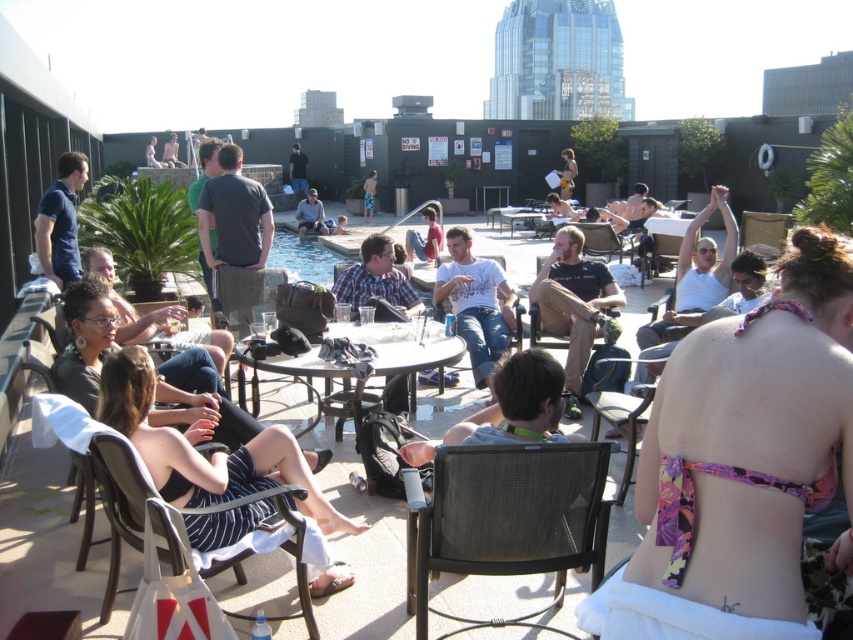
Question: Estimate the real-world distances between objects in this image. Which object is farther from the matte black chair at center?

Choices:
 (A) light brown wooden chair at center
 (B) pink floral bikini top at center
 (C) black mesh chair at lower center
 (D) yellow fabric shirt at center

Answer: (A)

Question: Which object appears farthest from the camera in this image?

Choices:
 (A) wooden table at center
 (B) matte black shirt at center

Answer: (A)

Question: Which object is the closest to the blue cotton shirt at upper left?

Choices:
 (A) matte black shirt at center
 (B) dark gray shirt at center
 (C) matte gray shirt at center
 (D) black mesh chair at lower left

Answer: (D)

Question: Is black mesh chair at lower left to the left of matte black shirt at center from the viewer's perspective?

Choices:
 (A) yes
 (B) no

Answer: (A)

Question: Does black mesh chair at lower center have a smaller size compared to dark gray shirt at center?

Choices:
 (A) no
 (B) yes

Answer: (B)

Question: Can you confirm if black mesh chair at lower left is wider than matte black shirt at center?

Choices:
 (A) yes
 (B) no

Answer: (A)